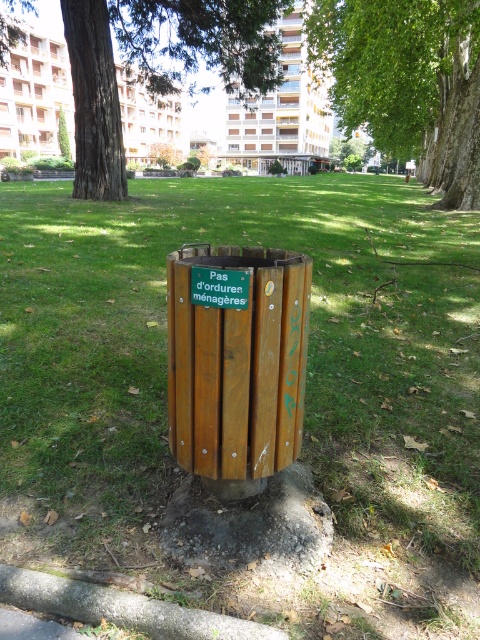
In the scene shown: You are standing at the origin point of the coordinate system. You want to walk to the wooden trash can at center. What are the coordinates you need to move to reach it?

The wooden trash can at center is located at coordinates point (x=237, y=362), so you need to move to that point to reach it.

In the scene shown: You are a gardener who needs to water the wooden trash can at center. Since it is under the green leafy tree at upper center, will the trash can get direct sunlight or stay in the shade?

The wooden trash can at center is positioned under the green leafy tree at upper center, so it will stay in the shade.